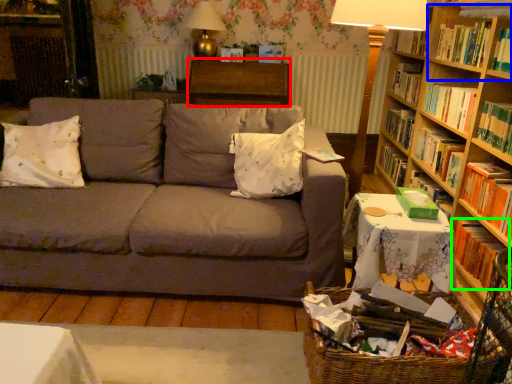
Question: Considering the real-world distances, which object is closest to table (highlighted by a red box)? shelf (highlighted by a blue box) or book (highlighted by a green box).

Choices:
 (A) shelf
 (B) book

Answer: (A)